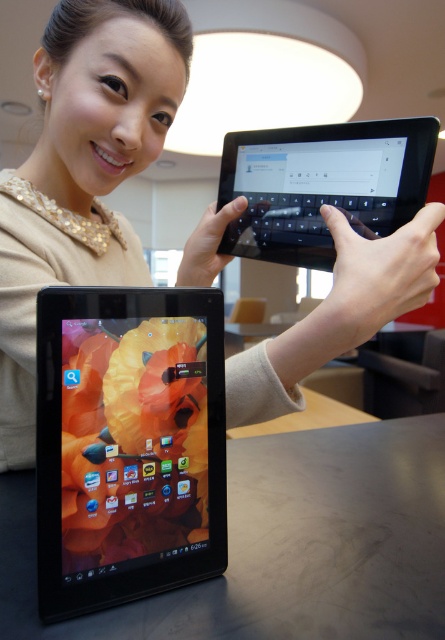
Does matte black tablet at lower left have a larger size compared to black matte table at lower center?

Correct, matte black tablet at lower left is larger in size than black matte table at lower center.

Between point (117, 257) and point (278, 600), which one is positioned behind?

The point (117, 257) is more distant.

Measure the distance between point (352, 292) and camera.

They are 47.79 centimeters apart.

Find the location of a particular element. The height and width of the screenshot is (640, 445). matte black tablet at lower left is located at coordinates (81, 173).

Does black matte table at lower center have a greater width compared to black glossy tablet at center?

Correct, the width of black matte table at lower center exceeds that of black glossy tablet at center.

How far apart are black matte table at lower center and black glossy tablet at center?

black matte table at lower center is 14.94 inches from black glossy tablet at center.

This screenshot has height=640, width=445. What do you see at coordinates (283, 545) in the screenshot?
I see `black matte table at lower center` at bounding box center [283, 545].

The image size is (445, 640). I want to click on black matte table at lower center, so (283, 545).

Which is above, matte black tablet at lower left or matte black tablet at center?

matte black tablet at lower left is above.

Is matte black tablet at lower left bigger than matte black tablet at center?

Yes.

Between point (420, 298) and point (80, 333), which one is positioned behind?

The point (420, 298) is more distant.

Where is `matte black tablet at lower left`? matte black tablet at lower left is located at coordinates (81, 173).